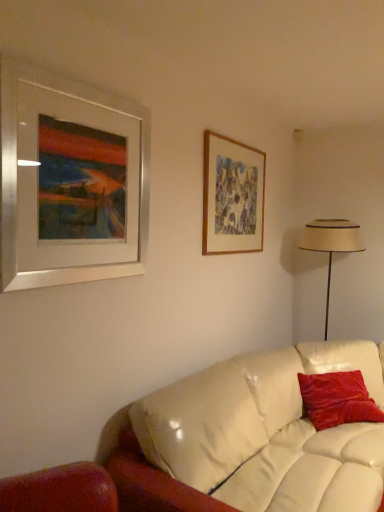
Question: From the image's perspective, would you say velvet red pillow at right is positioned over wooden picture frame at upper right, which is counted as the second picture frame, starting from the front?

Choices:
 (A) yes
 (B) no

Answer: (B)

Question: Can you confirm if velvet red pillow at right is smaller than wooden picture frame at upper right, which is counted as the second picture frame, starting from the left?

Choices:
 (A) yes
 (B) no

Answer: (B)

Question: Is velvet red pillow at right turned away from wooden picture frame at upper right, which is counted as the second picture frame, starting from the left?

Choices:
 (A) no
 (B) yes

Answer: (A)

Question: Does velvet red pillow at right appear on the right side of wooden picture frame at upper right, which is counted as the second picture frame, starting from the front?

Choices:
 (A) no
 (B) yes

Answer: (B)

Question: Is wooden picture frame at upper right, which is counted as the second picture frame, starting from the front, located within velvet red pillow at right?

Choices:
 (A) yes
 (B) no

Answer: (B)

Question: Does velvet red pillow at right appear on the left side of wooden picture frame at upper right, which is counted as the second picture frame, starting from the left?

Choices:
 (A) yes
 (B) no

Answer: (B)

Question: From a real-world perspective, is wooden picture frame at upper right, which is counted as the second picture frame, starting from the front, below velvet red pillow at right?

Choices:
 (A) yes
 (B) no

Answer: (B)

Question: Is wooden picture frame at upper right, placed as the 1th picture frame when sorted from right to left, to the left of velvet red pillow at right from the viewer's perspective?

Choices:
 (A) yes
 (B) no

Answer: (A)

Question: Is wooden picture frame at upper right, placed as the 1th picture frame when sorted from back to front, taller than velvet red pillow at right?

Choices:
 (A) no
 (B) yes

Answer: (B)

Question: From a real-world perspective, does wooden picture frame at upper right, which is counted as the second picture frame, starting from the left, stand above velvet red pillow at right?

Choices:
 (A) yes
 (B) no

Answer: (A)

Question: Is wooden picture frame at upper right, which is counted as the second picture frame, starting from the front, thinner than velvet red pillow at right?

Choices:
 (A) yes
 (B) no

Answer: (A)

Question: Is wooden picture frame at upper right, placed as the 1th picture frame when sorted from right to left, to the right of velvet red pillow at right from the viewer's perspective?

Choices:
 (A) yes
 (B) no

Answer: (B)

Question: Is velvet red pillow at right to the left of beige fabric lampshade at right from the viewer's perspective?

Choices:
 (A) yes
 (B) no

Answer: (A)